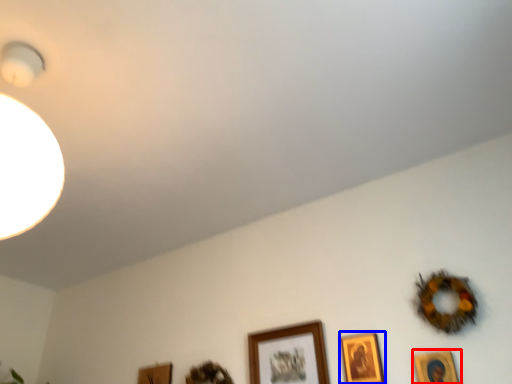
Question: Among these objects, which one is farthest to the camera, picture frame (highlighted by a red box) or picture frame (highlighted by a blue box)?

Choices:
 (A) picture frame
 (B) picture frame

Answer: (B)